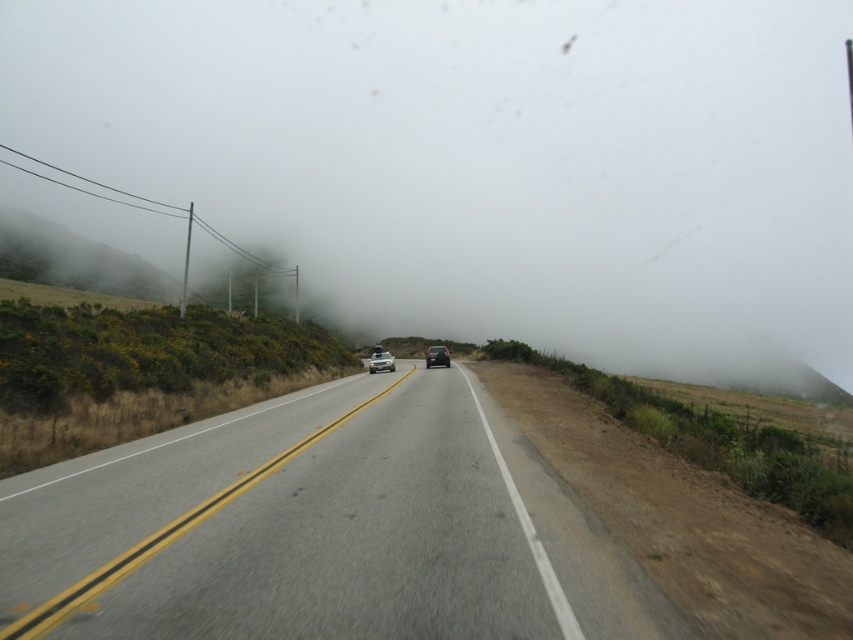
Question: Based on their relative distances, which object is nearer to the foggy mist at center?

Choices:
 (A) asphalt road at center
 (B) satin silver sedan at center
 (C) shiny black sedan at center

Answer: (C)

Question: Which point is farther to the camera?

Choices:
 (A) (445, 358)
 (B) (450, 572)

Answer: (A)

Question: Considering the relative positions of foggy mist at center and satin silver sedan at center in the image provided, where is foggy mist at center located with respect to satin silver sedan at center?

Choices:
 (A) right
 (B) left

Answer: (A)

Question: Is foggy mist at center wider than satin silver sedan at center?

Choices:
 (A) yes
 (B) no

Answer: (A)

Question: Does foggy mist at center appear over satin silver sedan at center?

Choices:
 (A) no
 (B) yes

Answer: (B)

Question: Which of the following is the farthest from the observer?

Choices:
 (A) foggy mist at center
 (B) satin silver sedan at center
 (C) asphalt road at center
 (D) shiny black sedan at center

Answer: (A)